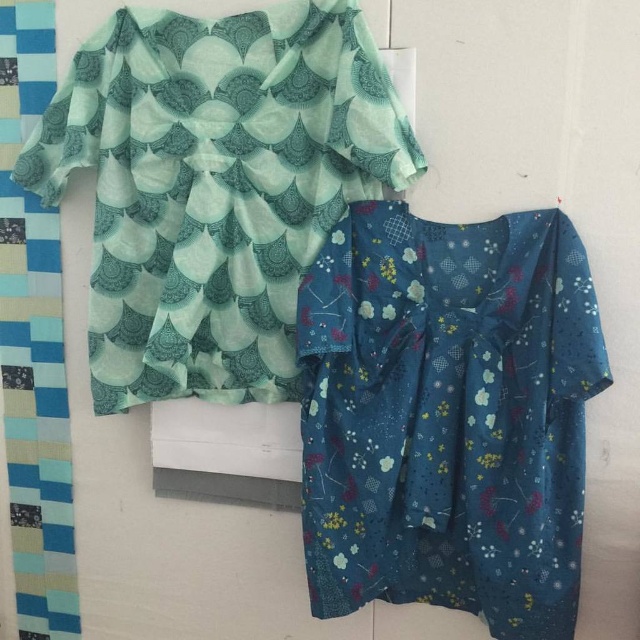
Question: Is blue floral fabric dress at lower right below teal fabric dress at upper left?

Choices:
 (A) yes
 (B) no

Answer: (A)

Question: Is blue floral fabric dress at lower right below teal fabric dress at upper left?

Choices:
 (A) yes
 (B) no

Answer: (A)

Question: Which object is farther from the camera taking this photo?

Choices:
 (A) blue floral fabric dress at lower right
 (B) teal fabric dress at upper left

Answer: (B)

Question: Is blue floral fabric dress at lower right smaller than teal fabric dress at upper left?

Choices:
 (A) yes
 (B) no

Answer: (A)

Question: Which point appears closest to the camera in this image?

Choices:
 (A) (186, 20)
 (B) (524, 506)

Answer: (B)